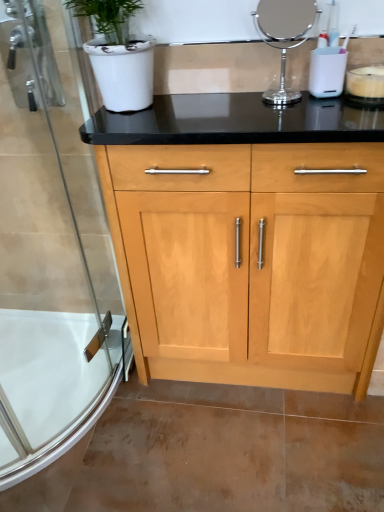
This screenshot has height=512, width=384. What do you see at coordinates (53, 387) in the screenshot?
I see `white glossy bath at lower left` at bounding box center [53, 387].

This screenshot has height=512, width=384. What are the coordinates of `white matte candle at upper right` in the screenshot? It's located at (366, 82).

Find the location of a particular element. The height and width of the screenshot is (512, 384). clear glass shower door at left is located at coordinates (49, 260).

Is clear glass shower door at left outside of white matte candle at upper right?

clear glass shower door at left lies outside white matte candle at upper right's area.

From a real-world perspective, is clear glass shower door at left physically below white matte candle at upper right?

Yes, from a real-world perspective, clear glass shower door at left is beneath white matte candle at upper right.

Locate an element on the screen. bath below the white matte candle at upper right (from the image's perspective) is located at coordinates (53, 387).

From the image's perspective, is white matte candle at upper right located beneath white glossy bath at lower left?

Incorrect, from the image's perspective, white matte candle at upper right is higher than white glossy bath at lower left.

Considering the sizes of objects white matte candle at upper right and white glossy bath at lower left in the image provided, who is bigger, white matte candle at upper right or white glossy bath at lower left?

Bigger between the two is white glossy bath at lower left.

Considering the positions of objects polished chrome mirror at upper center and white matte candle at upper right in the image provided, who is more to the right, polished chrome mirror at upper center or white matte candle at upper right?

Positioned to the right is white matte candle at upper right.

Which object is thinner, polished chrome mirror at upper center or white matte candle at upper right?

Thinner between the two is polished chrome mirror at upper center.

Considering the positions of points (258, 8) and (381, 84), is point (258, 8) farther from camera compared to point (381, 84)?

Yes.

Based on the photo, does polished chrome mirror at upper center touch white glossy bath at lower left?

No, polished chrome mirror at upper center is not next to white glossy bath at lower left.

Is polished chrome mirror at upper center turned away from white glossy bath at lower left?

polished chrome mirror at upper center does not have its back to white glossy bath at lower left.

Considering the positions of objects polished chrome mirror at upper center and white glossy bath at lower left in the image provided, who is more to the left, polished chrome mirror at upper center or white glossy bath at lower left?

Positioned to the left is white glossy bath at lower left.

From a real-world perspective, is polished chrome mirror at upper center below white glossy bath at lower left?

No, from a real-world perspective, polished chrome mirror at upper center is not beneath white glossy bath at lower left.

From the picture: From a real-world perspective, is clear glass shower door at left above or below white glossy bath at lower left?

In terms of real-world spatial position, clear glass shower door at left is above white glossy bath at lower left.

Is clear glass shower door at left positioned with its back to white glossy bath at lower left?

Yes, clear glass shower door at left's orientation is away from white glossy bath at lower left.

From the image's perspective, does clear glass shower door at left appear higher than white glossy bath at lower left?

Yes, from the image's perspective, clear glass shower door at left is over white glossy bath at lower left.

Based on the photo, in the image, is white matte candle at upper right positioned in front of or behind clear glass shower door at left?

Clearly, white matte candle at upper right is behind clear glass shower door at left.

Is white matte candle at upper right facing away from clear glass shower door at left?

No.

Looking at this image, from a real-world perspective, is white matte candle at upper right physically below clear glass shower door at left?

No, from a real-world perspective, white matte candle at upper right is not under clear glass shower door at left.

Considering the sizes of objects white matte candle at upper right and clear glass shower door at left in the image provided, who is wider, white matte candle at upper right or clear glass shower door at left?

clear glass shower door at left.

Considering the relative sizes of white glossy bath at lower left and clear glass shower door at left in the image provided, is white glossy bath at lower left bigger than clear glass shower door at left?

No, white glossy bath at lower left is not bigger than clear glass shower door at left.

Is white glossy bath at lower left in front of clear glass shower door at left?

No, it is not.

In the image, is white glossy bath at lower left on the left side or the right side of clear glass shower door at left?

Based on their positions, white glossy bath at lower left is located to the left of clear glass shower door at left.

Where is `soap lying on the right of clear glass shower door at left`? Image resolution: width=384 pixels, height=512 pixels. soap lying on the right of clear glass shower door at left is located at coordinates (x=366, y=82).

You are a GUI agent. You are given a task and a screenshot of the screen. Output one action in this format:
    pyautogui.click(x=<x>, y=<y>)
    Task: Click on the bath on the left of white matte candle at upper right
    
    Given the screenshot: What is the action you would take?
    pyautogui.click(x=53, y=387)

Which object lies nearer to the anchor point white matte candle at upper right, polished chrome mirror at upper center or clear glass shower door at left?

polished chrome mirror at upper center is closer to white matte candle at upper right.

Based on their spatial positions, is white glossy bath at lower left or polished chrome mirror at upper center further from white matte candle at upper right?

Based on the image, white glossy bath at lower left appears to be further to white matte candle at upper right.

When comparing their distances from polished chrome mirror at upper center, does clear glass shower door at left or white matte candle at upper right seem closer?

white matte candle at upper right is closer to polished chrome mirror at upper center.

Considering their positions, is white matte candle at upper right positioned closer to white glossy bath at lower left than clear glass shower door at left?

clear glass shower door at left.

Estimate the real-world distances between objects in this image. Which object is further from polished chrome mirror at upper center, white glossy bath at lower left or clear glass shower door at left?

The object further to polished chrome mirror at upper center is white glossy bath at lower left.

Looking at this image, when comparing their distances from clear glass shower door at left, does white glossy bath at lower left or polished chrome mirror at upper center seem further?

Based on the image, polished chrome mirror at upper center appears to be further to clear glass shower door at left.

Based on their spatial positions, is clear glass shower door at left or white matte candle at upper right further from white glossy bath at lower left?

Among the two, white matte candle at upper right is located further to white glossy bath at lower left.

Estimate the real-world distances between objects in this image. Which object is closer to white matte candle at upper right, clear glass shower door at left or white glossy bath at lower left?

The object closer to white matte candle at upper right is clear glass shower door at left.

Locate an element on the screen. The width and height of the screenshot is (384, 512). soap that lies between polished chrome mirror at upper center and white glossy bath at lower left from top to bottom is located at coordinates (366, 82).

Find the location of a particular element. The height and width of the screenshot is (512, 384). appliance between clear glass shower door at left and white matte candle at upper right in the horizontal direction is located at coordinates coord(284,37).

At what (x,y) coordinates should I click in order to perform the action: click on shower door between white glossy bath at lower left and white matte candle at upper right from left to right. Please return your answer as a coordinate pair (x, y). Looking at the image, I should click on (49, 260).

Find the location of a particular element. shower door between polished chrome mirror at upper center and white glossy bath at lower left in the up-down direction is located at coordinates (49, 260).